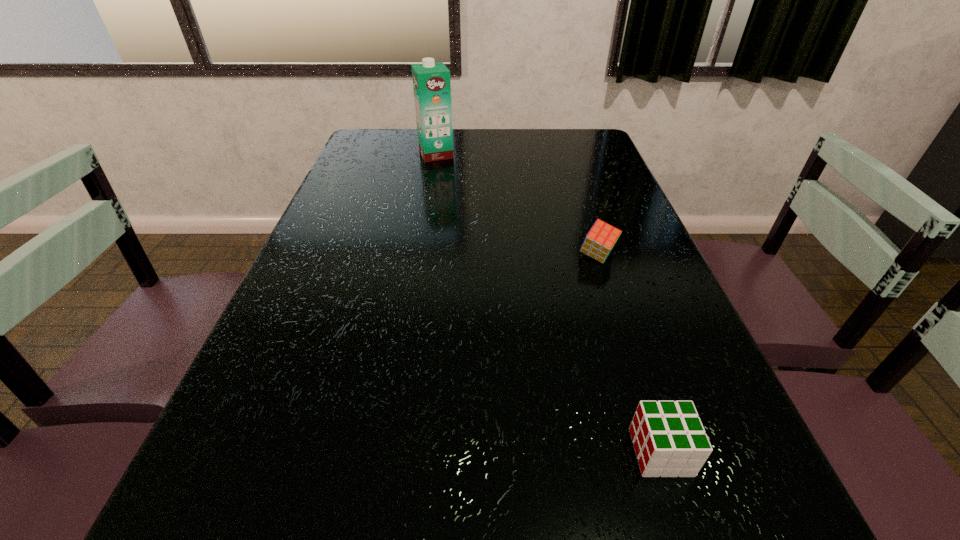
This screenshot has width=960, height=540. Find the location of `the farthest object`. the farthest object is located at coordinates (431, 81).

Locate an element on the screen. This screenshot has height=540, width=960. the leftmost object is located at coordinates (431, 81).

Where is `the second nearest object`? the second nearest object is located at coordinates (602, 237).

Identify the location of the nearer cube. (669, 439).

Locate an element on the screen. The width and height of the screenshot is (960, 540). free space located 0.130m on the back of the farthest object is located at coordinates (440, 131).

Where is `blank space located on the right of the second farthest object`? The image size is (960, 540). blank space located on the right of the second farthest object is located at coordinates (649, 256).

You are a GUI agent. You are given a task and a screenshot of the screen. Output one action in this format:
    pyautogui.click(x=<x>, y=<y>)
    Task: Click on the vacant space located on the red face of the nearer cube
    The image size is (960, 540).
    Given the screenshot: What is the action you would take?
    pyautogui.click(x=603, y=452)

Locate an element on the screen. Image resolution: width=960 pixels, height=540 pixels. vacant space located 0.230m on the red face of the nearer cube is located at coordinates (489, 452).

The height and width of the screenshot is (540, 960). Identify the location of vacant area situated 0.120m on the red face of the nearer cube. (559, 452).

Locate an element on the screen. This screenshot has height=540, width=960. object at the far edge is located at coordinates (431, 81).